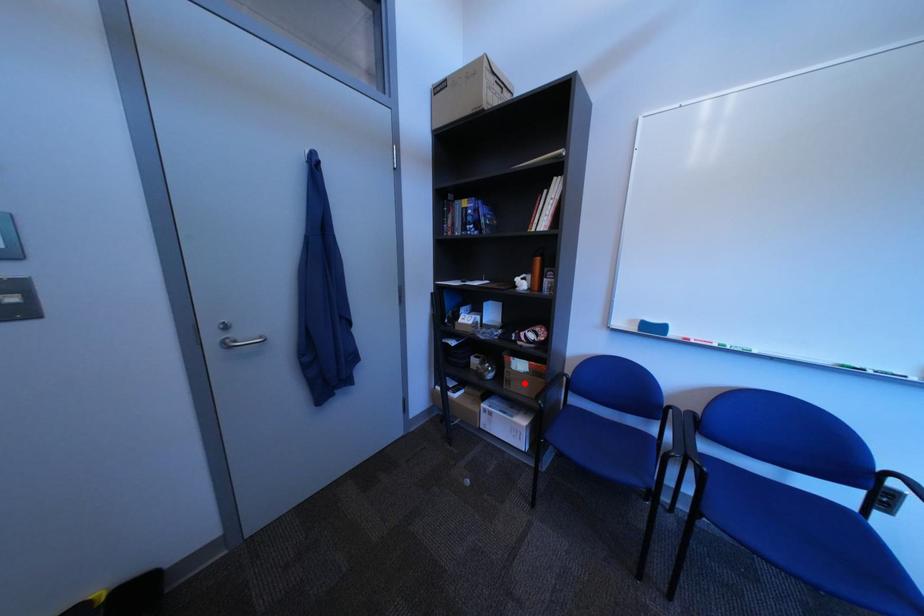
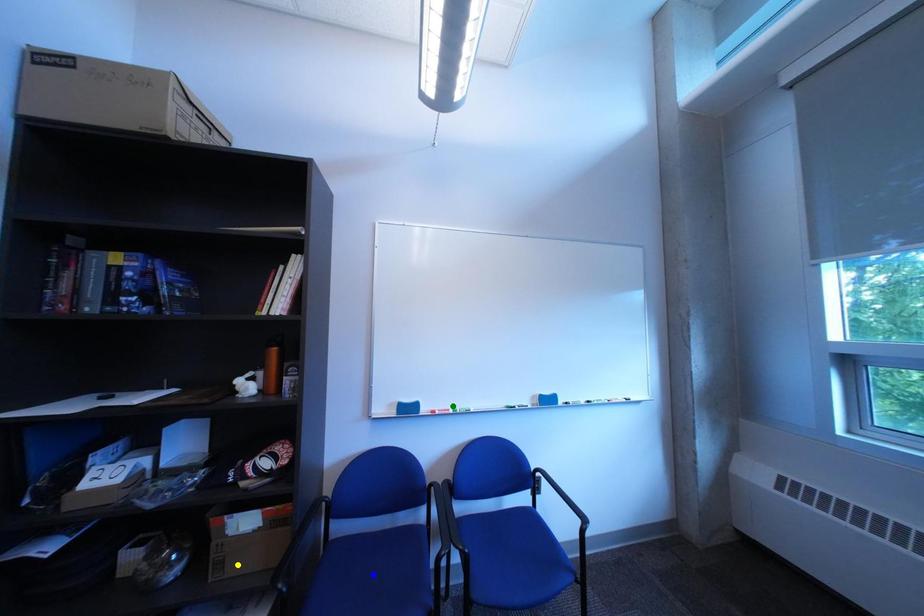
Question: I am providing you with two images of the same scene from different viewpoints. A red point is marked on the first image. You are given multiple points on the second image. Can you choose the point in image 2 that corresponds to the point in image 1?

Choices:
 (A) yellow point
 (B) green point
 (C) blue point

Answer: (A)